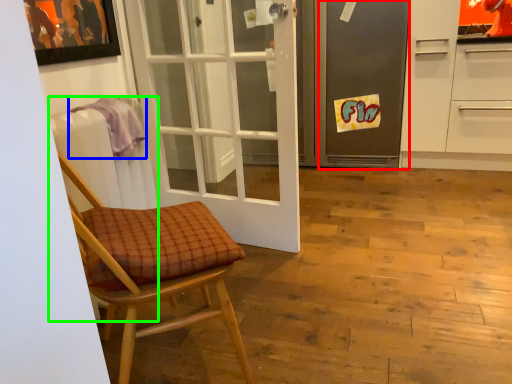
Question: Which is farther away from screen door (highlighted by a red box)? towel/napkin (highlighted by a blue box) or radiator (highlighted by a green box)?

Choices:
 (A) towel/napkin
 (B) radiator

Answer: (B)